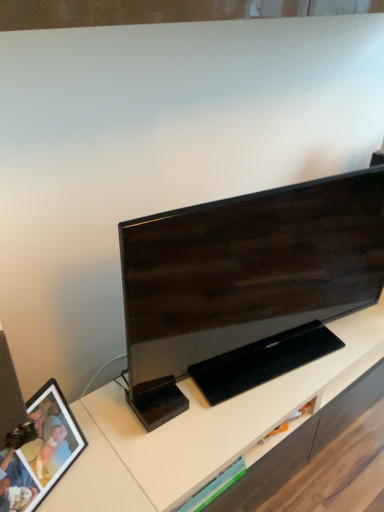
Question: Does matte black picture frame at lower left have a greater width compared to matte black tv at center?

Choices:
 (A) yes
 (B) no

Answer: (B)

Question: Does matte black picture frame at lower left have a lesser width compared to matte black tv at center?

Choices:
 (A) yes
 (B) no

Answer: (A)

Question: From a real-world perspective, is matte black picture frame at lower left under matte black tv at center?

Choices:
 (A) no
 (B) yes

Answer: (B)

Question: Is matte black tv at center completely or partially inside matte black picture frame at lower left?

Choices:
 (A) yes
 (B) no

Answer: (B)

Question: From the image's perspective, is matte black picture frame at lower left beneath matte black tv at center?

Choices:
 (A) no
 (B) yes

Answer: (B)

Question: Is matte black picture frame at lower left positioned beyond the bounds of matte black tv at center?

Choices:
 (A) no
 (B) yes

Answer: (B)

Question: Can you confirm if matte black tv at center is shorter than matte black picture frame at lower left?

Choices:
 (A) yes
 (B) no

Answer: (B)

Question: From the image's perspective, is matte black tv at center on matte black picture frame at lower left?

Choices:
 (A) no
 (B) yes

Answer: (B)

Question: Is matte black tv at center oriented away from matte black picture frame at lower left?

Choices:
 (A) yes
 (B) no

Answer: (B)

Question: Is matte black picture frame at lower left surrounded by matte black tv at center?

Choices:
 (A) no
 (B) yes

Answer: (A)

Question: From the image's perspective, does matte black tv at center appear lower than matte black picture frame at lower left?

Choices:
 (A) yes
 (B) no

Answer: (B)

Question: From a real-world perspective, is matte black tv at center physically above matte black picture frame at lower left?

Choices:
 (A) yes
 (B) no

Answer: (A)

Question: Is matte black picture frame at lower left in front of or behind matte black tv at center in the image?

Choices:
 (A) front
 (B) behind

Answer: (A)